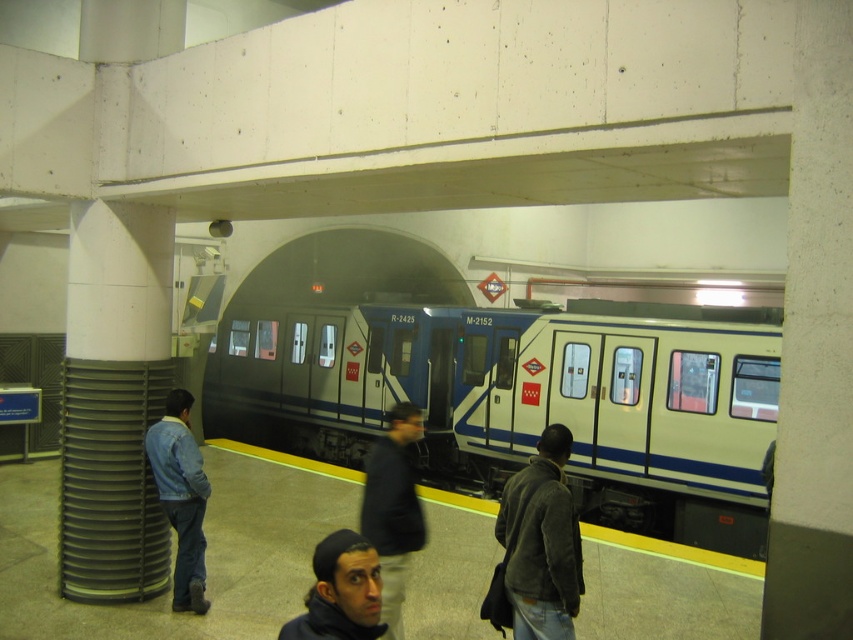
Question: Which of the following is the farthest from the observer?

Choices:
 (A) (374, 637)
 (B) (366, 458)

Answer: (B)

Question: Can you confirm if white glossy train at center is positioned below dark blue knit cap at lower center?

Choices:
 (A) no
 (B) yes

Answer: (B)

Question: Which point is farther to the camera?

Choices:
 (A) (384, 545)
 (B) (148, 452)
 (C) (624, 476)
 (D) (363, 566)

Answer: (C)

Question: Which of the following is the closest to the observer?

Choices:
 (A) dark blue knit cap at lower center
 (B) denim jacket at left
 (C) dark brown fuzzy jacket at center
 (D) dark blue jacket at center

Answer: (A)

Question: Does denim jacket at left appear on the right side of dark blue knit cap at lower center?

Choices:
 (A) yes
 (B) no

Answer: (B)

Question: Is white glossy train at center above denim jacket at left?

Choices:
 (A) yes
 (B) no

Answer: (B)